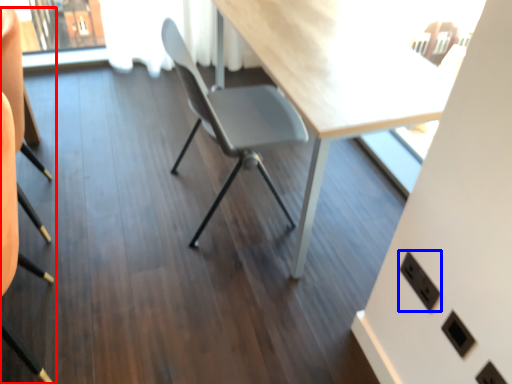
Question: Among these objects, which one is farthest to the camera, chair (highlighted by a red box) or electric outlet (highlighted by a blue box)?

Choices:
 (A) chair
 (B) electric outlet

Answer: (B)